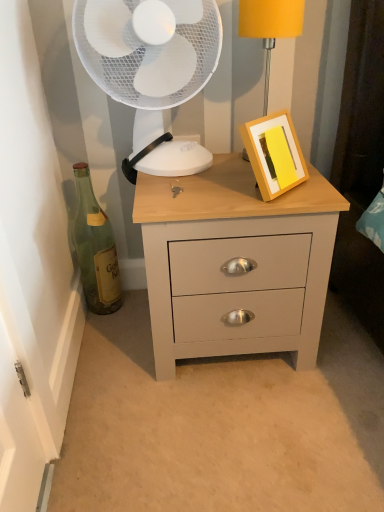
From the picture: Measure the distance between white plastic fan at upper center and camera.

The distance of white plastic fan at upper center from camera is 35.45 inches.

Describe the element at coordinates (95, 248) in the screenshot. I see `green glass bottle at left` at that location.

Where is `white plastic fan at upper center`? The image size is (384, 512). white plastic fan at upper center is located at coordinates (151, 69).

From a real-world perspective, which is physically below, matte yellow lampshade at upper right or yellow matte picture frame at upper right?

yellow matte picture frame at upper right is physically lower.

Is matte yellow lampshade at upper right positioned before yellow matte picture frame at upper right?

No, matte yellow lampshade at upper right is behind yellow matte picture frame at upper right.

From the image's perspective, is matte yellow lampshade at upper right positioned above or below yellow matte picture frame at upper right?

From the image's perspective, matte yellow lampshade at upper right appears above yellow matte picture frame at upper right.

Is white plastic fan at upper center positioned far away from matte gray chest of drawers at center?

No.

Which object is closer to the camera, white plastic fan at upper center or matte gray chest of drawers at center?

Positioned in front is white plastic fan at upper center.

Looking at this image, considering the relative sizes of white plastic fan at upper center and matte gray chest of drawers at center in the image provided, is white plastic fan at upper center taller than matte gray chest of drawers at center?

In fact, white plastic fan at upper center may be shorter than matte gray chest of drawers at center.

In the scene shown: Between matte gray chest of drawers at center and green glass bottle at left, which one has smaller width?

Thinner between the two is green glass bottle at left.

Which is more to the left, matte gray chest of drawers at center or green glass bottle at left?

From the viewer's perspective, green glass bottle at left appears more on the left side.

Is matte gray chest of drawers at center situated inside green glass bottle at left or outside?

matte gray chest of drawers at center is outside green glass bottle at left.

Between point (231, 304) and point (116, 254), which one is positioned behind?

The point (116, 254) is behind.

How many degrees apart are the facing directions of yellow matte picture frame at upper right and green glass bottle at left?

yellow matte picture frame at upper right and green glass bottle at left are facing 41.9 degrees away from each other.

Could you tell me if yellow matte picture frame at upper right is turned towards green glass bottle at left?

No, yellow matte picture frame at upper right is not oriented towards green glass bottle at left.

Between yellow matte picture frame at upper right and green glass bottle at left, which one has larger width?

With larger width is yellow matte picture frame at upper right.

Is yellow matte picture frame at upper right smaller than green glass bottle at left?

Indeed, yellow matte picture frame at upper right has a smaller size compared to green glass bottle at left.

Does green glass bottle at left turn towards white plastic fan at upper center?

No.

From a real-world perspective, between green glass bottle at left and white plastic fan at upper center, who is vertically lower?

green glass bottle at left.

From the picture: Is green glass bottle at left to the left or to the right of white plastic fan at upper center in the image?

From the image, it's evident that green glass bottle at left is to the left of white plastic fan at upper center.

Can you confirm if matte gray chest of drawers at center is thinner than yellow matte picture frame at upper right?

No, matte gray chest of drawers at center is not thinner than yellow matte picture frame at upper right.

Is matte gray chest of drawers at center inside the boundaries of yellow matte picture frame at upper right, or outside?

matte gray chest of drawers at center is outside yellow matte picture frame at upper right.

Relative to yellow matte picture frame at upper right, is matte gray chest of drawers at center in front or behind?

matte gray chest of drawers at center is behind yellow matte picture frame at upper right.

From a real-world perspective, which is physically below, matte gray chest of drawers at center or yellow matte picture frame at upper right?

matte gray chest of drawers at center, from a real-world perspective.

Which object is positioned more to the left, yellow matte picture frame at upper right or white plastic fan at upper center?

white plastic fan at upper center is more to the left.

Between yellow matte picture frame at upper right and white plastic fan at upper center, which one has larger size?

white plastic fan at upper center.

The height and width of the screenshot is (512, 384). I want to click on picture frame on the left of matte yellow lampshade at upper right, so click(274, 154).

This screenshot has width=384, height=512. What are the coordinates of `chest of drawers below the white plastic fan at upper center (from the image's perspective)` in the screenshot? It's located at (237, 263).

Estimate the real-world distances between objects in this image. Which object is further from matte yellow lampshade at upper right, yellow matte picture frame at upper right or white plastic fan at upper center?

yellow matte picture frame at upper right.

Which object lies nearer to the anchor point matte gray chest of drawers at center, white plastic fan at upper center or yellow matte picture frame at upper right?

yellow matte picture frame at upper right.

Considering their positions, is matte gray chest of drawers at center positioned further to yellow matte picture frame at upper right than green glass bottle at left?

green glass bottle at left is further to yellow matte picture frame at upper right.

Which object lies further to the anchor point matte yellow lampshade at upper right, yellow matte picture frame at upper right or matte gray chest of drawers at center?

matte gray chest of drawers at center.

From the image, which object appears to be nearer to yellow matte picture frame at upper right, matte yellow lampshade at upper right or green glass bottle at left?

Among the two, matte yellow lampshade at upper right is located nearer to yellow matte picture frame at upper right.

Which object lies nearer to the anchor point yellow matte picture frame at upper right, matte gray chest of drawers at center or white plastic fan at upper center?

The object closer to yellow matte picture frame at upper right is matte gray chest of drawers at center.

Which object lies further to the anchor point white plastic fan at upper center, yellow matte picture frame at upper right or matte yellow lampshade at upper right?

yellow matte picture frame at upper right is positioned further to the anchor white plastic fan at upper center.

Considering their positions, is green glass bottle at left positioned closer to white plastic fan at upper center than yellow matte picture frame at upper right?

The object closer to white plastic fan at upper center is yellow matte picture frame at upper right.

The height and width of the screenshot is (512, 384). In order to click on bottle between white plastic fan at upper center and matte gray chest of drawers at center from top to bottom in this screenshot , I will do [95, 248].

Locate an element on the screen. The width and height of the screenshot is (384, 512). picture frame between white plastic fan at upper center and matte gray chest of drawers at center vertically is located at coordinates (274, 154).

Where is `the chest of drawers situated between green glass bottle at left and matte yellow lampshade at upper right from left to right`? the chest of drawers situated between green glass bottle at left and matte yellow lampshade at upper right from left to right is located at coordinates (237, 263).

At what (x,y) coordinates should I click in order to perform the action: click on picture frame between matte yellow lampshade at upper right and matte gray chest of drawers at center in the vertical direction. Please return your answer as a coordinate pair (x, y). The width and height of the screenshot is (384, 512). Looking at the image, I should click on (274, 154).